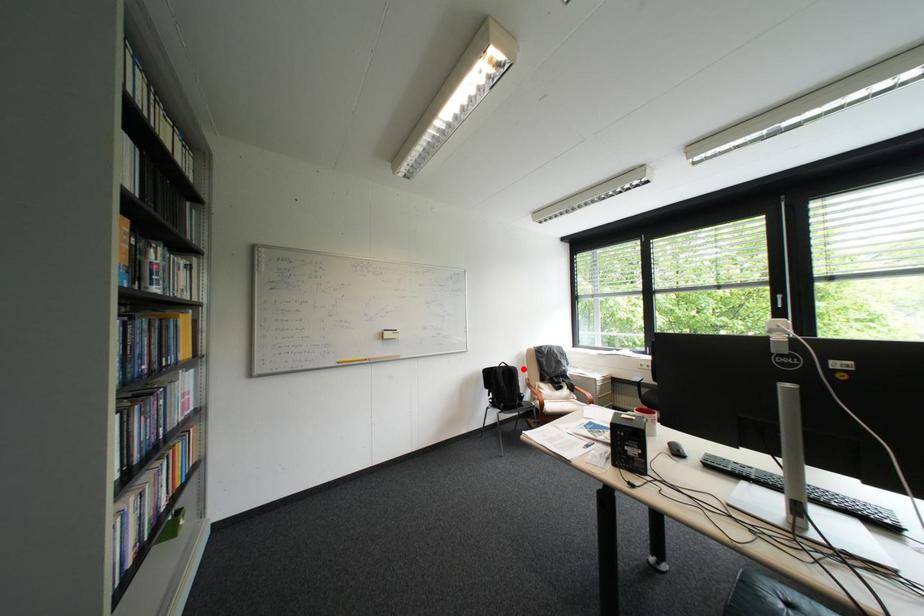
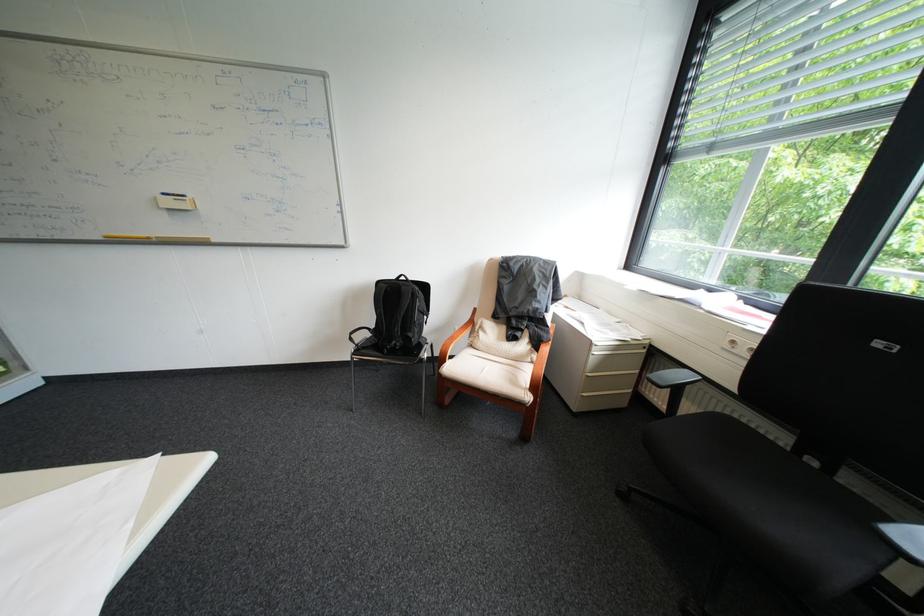
Question: I am providing you with two images of the same scene from different viewpoints. Given a red point in image1, look at the same physical point in image2. Is it:

Choices:
 (A) Closer to the viewpoint
 (B) Farther from the viewpoint

Answer: (A)